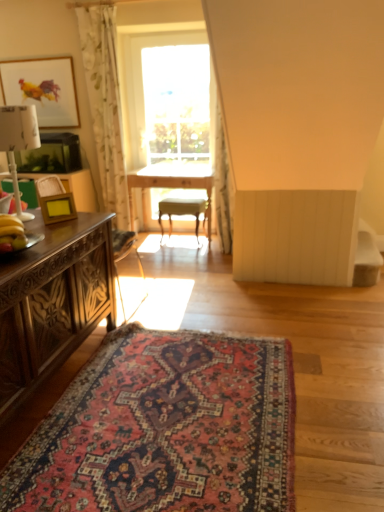
Question: Choose the correct answer: Is white floral fabric curtain at upper center, marked as the second curtain in a left-to-right arrangement, inside matte wooden picture frame at upper left, the second picture frame in the front-to-back sequence, or outside it?

Choices:
 (A) outside
 (B) inside

Answer: (A)

Question: From a real-world perspective, is white floral fabric curtain at upper center, positioned as the first curtain in right-to-left order, positioned above or below matte wooden picture frame at upper left, the 1th picture frame in the top-to-bottom sequence?

Choices:
 (A) below
 (B) above

Answer: (A)

Question: Based on their relative distances, which object is farther from the wooden photo frame at left, the first picture frame in the right-to-left sequence?

Choices:
 (A) carpeted mat at lower center
 (B) carved wood desk at left
 (C) yellow matte banana at left
 (D) light yellow wood chair at center
 (E) wooden table at center

Answer: (E)

Question: Which object is the farthest from the matte wooden picture frame at upper left, the 1th picture frame in the top-to-bottom sequence?

Choices:
 (A) white fabric lampshade at left
 (B) wooden photo frame at left, the second picture frame viewed from the top
 (C) white floral fabric curtain at upper center, marked as the second curtain in a left-to-right arrangement
 (D) clear glass window at center
 (E) translucent floral fabric at left, the 1th curtain viewed from the left

Answer: (A)